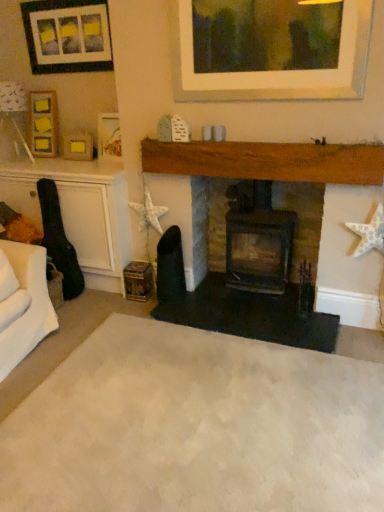
Question: From the image's perspective, does matte wooden picture frame at upper left, the third picture frame viewed from the top, appear higher than black matte fireplace at center, the second fireplace positioned from the left?

Choices:
 (A) yes
 (B) no

Answer: (A)

Question: Can you confirm if matte wooden picture frame at upper left, arranged as the 2th picture frame when ordered from the bottom, is taller than black matte fireplace at center, the first fireplace viewed from the right?

Choices:
 (A) no
 (B) yes

Answer: (A)

Question: Is matte wooden picture frame at upper left, the third picture frame viewed from the top, outside black matte fireplace at center, the first fireplace viewed from the right?

Choices:
 (A) yes
 (B) no

Answer: (A)

Question: From a real-world perspective, is matte wooden picture frame at upper left, the third picture frame viewed from the top, physically below black matte fireplace at center, the second fireplace positioned from the left?

Choices:
 (A) yes
 (B) no

Answer: (B)

Question: Is matte wooden picture frame at upper left, the third picture frame viewed from the top, further to the viewer compared to black matte fireplace at center, the first fireplace viewed from the right?

Choices:
 (A) no
 (B) yes

Answer: (B)

Question: Considering the positions of matte gold picture frame at upper left, which appears as the first picture frame when ordered from the bottom, and black matte fireplace at center, the first fireplace viewed from the right, in the image, is matte gold picture frame at upper left, which appears as the first picture frame when ordered from the bottom, taller or shorter than black matte fireplace at center, the first fireplace viewed from the right,?

Choices:
 (A) short
 (B) tall

Answer: (A)

Question: Is point (69, 159) positioned closer to the camera than point (223, 264)?

Choices:
 (A) closer
 (B) farther

Answer: (B)

Question: Relative to black matte fireplace at center, the second fireplace positioned from the left, is matte gold picture frame at upper left, which appears as the first picture frame when ordered from the bottom, in front or behind?

Choices:
 (A) behind
 (B) front

Answer: (A)

Question: From the image's perspective, is matte gold picture frame at upper left, which appears as the first picture frame when ordered from the bottom, located above or below black matte fireplace at center, the second fireplace positioned from the left?

Choices:
 (A) above
 (B) below

Answer: (A)

Question: Considering their positions, is beige carpet at center located in front of or behind matte black fireplace at center, placed as the first fireplace when sorted from left to right?

Choices:
 (A) front
 (B) behind

Answer: (A)

Question: Does point (208, 479) appear closer or farther from the camera than point (211, 155)?

Choices:
 (A) closer
 (B) farther

Answer: (A)

Question: Considering the positions of beige carpet at center and matte black fireplace at center, the 2th fireplace when ordered from right to left, in the image, is beige carpet at center bigger or smaller than matte black fireplace at center, the 2th fireplace when ordered from right to left,?

Choices:
 (A) small
 (B) big

Answer: (B)

Question: In terms of width, does beige carpet at center look wider or thinner when compared to matte black fireplace at center, placed as the first fireplace when sorted from left to right?

Choices:
 (A) thin
 (B) wide

Answer: (B)

Question: In the image, is matte wooden picture frame at upper left, arranged as the 2th picture frame when ordered from the bottom, on the left side or the right side of black matte fireplace at center, the first fireplace viewed from the right?

Choices:
 (A) left
 (B) right

Answer: (A)

Question: In terms of width, does matte wooden picture frame at upper left, arranged as the 2th picture frame when ordered from the bottom, look wider or thinner when compared to black matte fireplace at center, the first fireplace viewed from the right?

Choices:
 (A) thin
 (B) wide

Answer: (A)